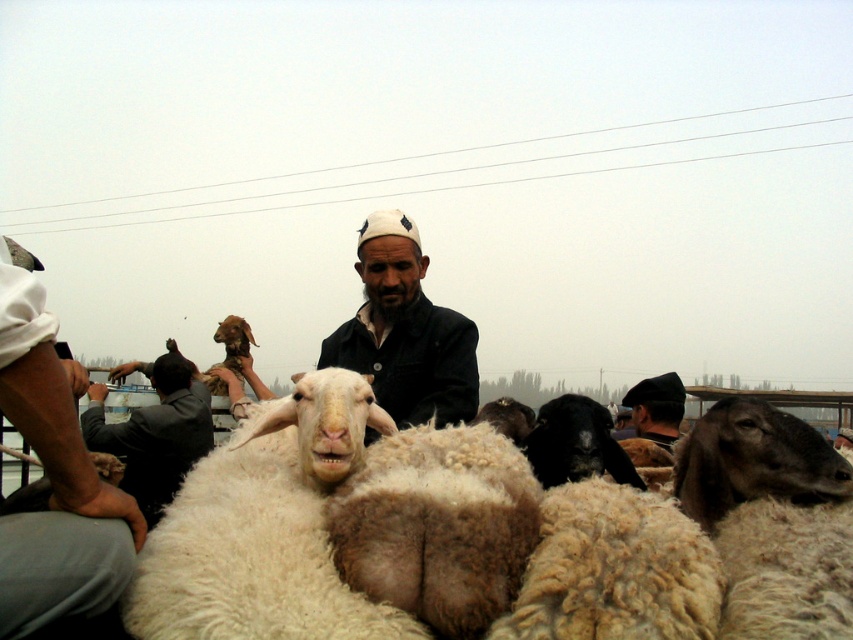
You are a photographer at the livestock market. You want to capture a photo that includes both the dark blue fabric at center and the dark gray woolen hat at right. Which object should you adjust your camera angle to focus on first if you want to ensure both are in frame?

The dark blue fabric at center has a smaller size compared to the dark gray woolen hat at right, so you should focus on the larger dark gray woolen hat at right first to ensure both fit in the frame.

You are standing at the origin point in the image. Which of the two points, point [62,518] or point [155,410], is closer to you?

Point [62,518] is closer to you because it is in front of point [155,410].

You are a farmer who wants to know if the white woolen sheep at lower left can fit under the gray woolen jacket at left without needing to bend down. Based on their heights, what do you think?

The white woolen sheep at lower left is not as tall as the gray woolen jacket at left, so the sheep can fit under the jacket without needing to bend down.